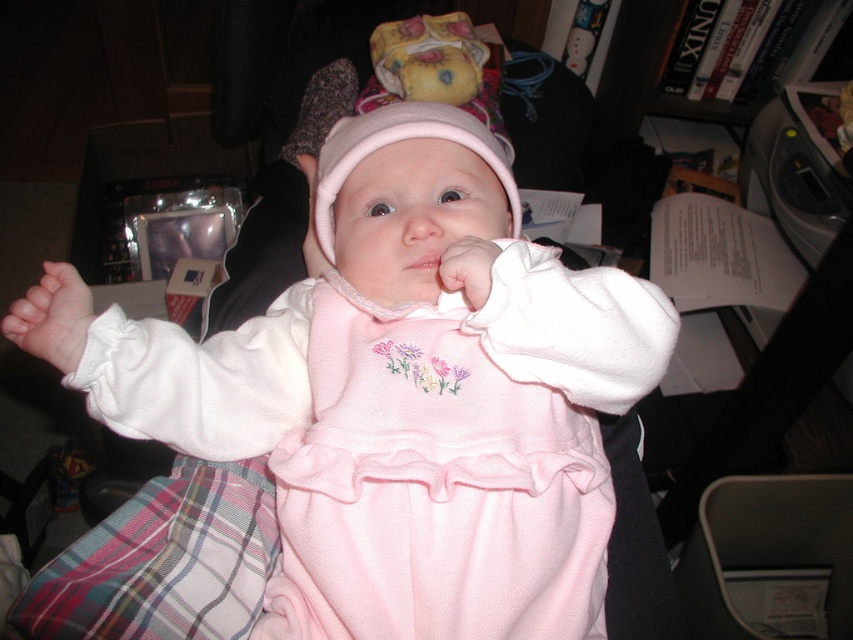
Based on the scene description, where is the pink cotton dress at center located in terms of coordinates?

The pink cotton dress at center is located at coordinates point (444, 467).

In the image, there is a baby wearing a light pink outfit with a matching bonnet. The baby has its hands slightly raised, one near its mouth. There is a point marked at coordinates [51,317]. What does this point represent?

The point at [51,317] marks the pink fabric hand at center.

You are a photographer adjusting your camera. You notice two points in the image at coordinates point (329, 412) and point (460, 282). Which point is closer to your camera lens?

Point (329, 412) is further to the viewer than point (460, 282), so the closer point to the camera lens would be point (460, 282).